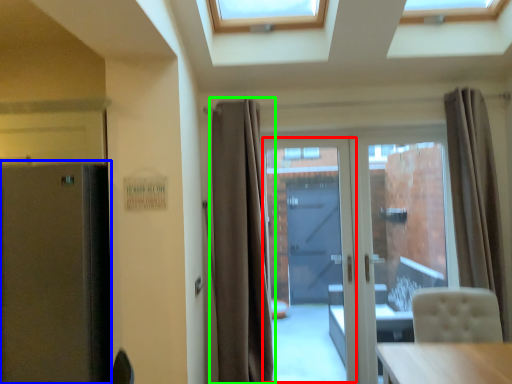
Question: Which object is positioned closest to garage door (highlighted by a red box)? Select from fridge (highlighted by a blue box) and curtain (highlighted by a green box).

Choices:
 (A) fridge
 (B) curtain

Answer: (B)